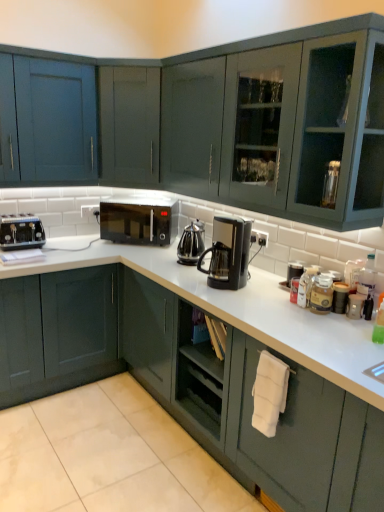
Locate an element on the screen. vacant region in front of black plastic coffee maker at center is located at coordinates (239, 297).